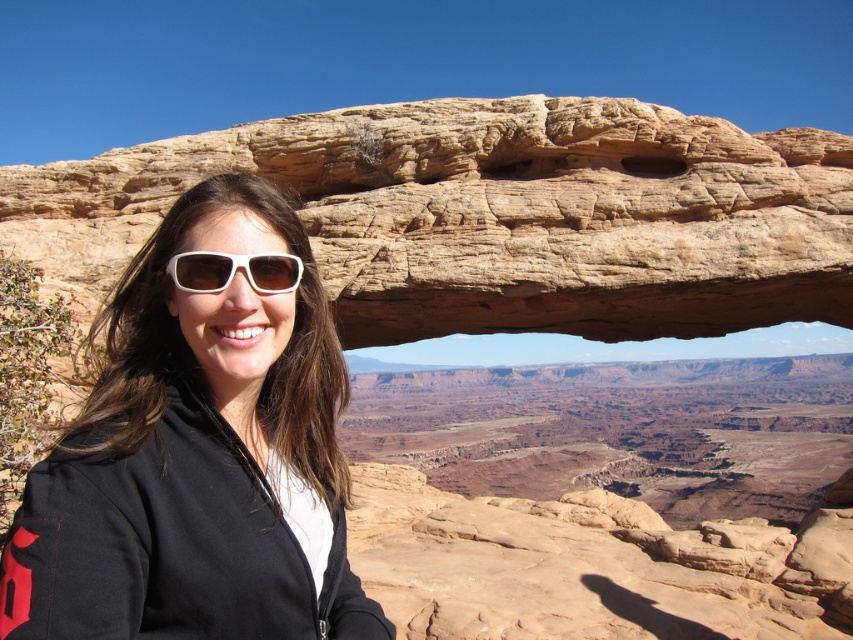
Question: Does rustic sandstone arch at center appear over white matte sunglasses at center?

Choices:
 (A) no
 (B) yes

Answer: (B)

Question: Can you confirm if rustic sandstone arch at center is smaller than matte black jacket at left?

Choices:
 (A) no
 (B) yes

Answer: (A)

Question: Among these objects, which one is farthest from the camera?

Choices:
 (A) rustic sandstone arch at center
 (B) matte black jacket at left

Answer: (A)

Question: Is rustic sandstone arch at center to the right of white matte sunglasses at center from the viewer's perspective?

Choices:
 (A) no
 (B) yes

Answer: (B)

Question: Which object appears farthest from the camera in this image?

Choices:
 (A) rustic sandstone arch at center
 (B) matte black jacket at left
 (C) white matte sunglasses at center

Answer: (A)

Question: Estimate the real-world distances between objects in this image. Which object is closer to the matte black jacket at left?

Choices:
 (A) rustic sandstone arch at center
 (B) white matte sunglasses at center

Answer: (B)